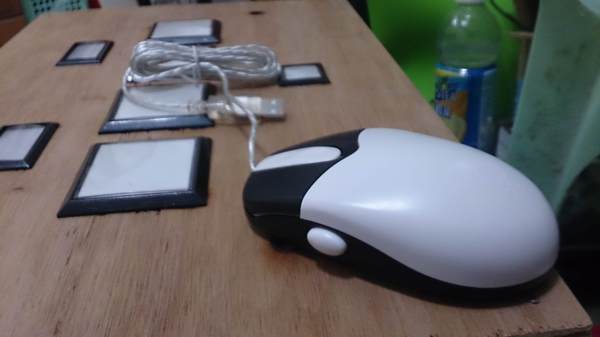
In order to click on mouse cord in this screenshot , I will do `click(210, 60)`.